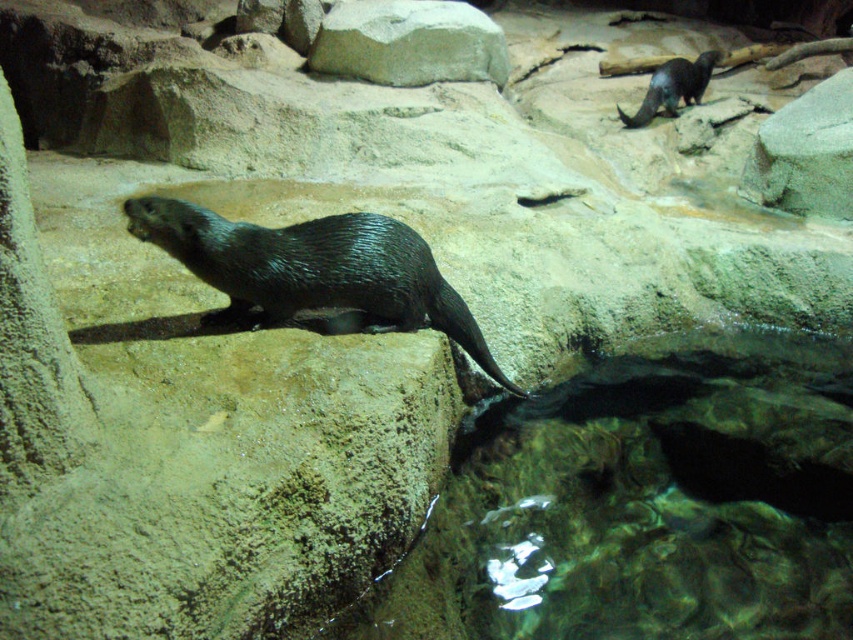
Does shiny black otter at center appear under shiny black beaver at upper right?

Yes.

Who is shorter, shiny black otter at center or shiny black beaver at upper right?

With less height is shiny black beaver at upper right.

Is point (325, 264) closer to camera compared to point (630, 124)?

Yes.

This screenshot has height=640, width=853. Find the location of `shiny black otter at center`. shiny black otter at center is located at coordinates (314, 268).

Can you confirm if shiny black otter at center is taller than gray stone boulder at upper center?

No, shiny black otter at center is not taller than gray stone boulder at upper center.

Can you confirm if shiny black otter at center is positioned to the right of gray stone boulder at upper center?

Incorrect, shiny black otter at center is not on the right side of gray stone boulder at upper center.

Is point (201, 237) positioned after point (320, 49)?

No, (201, 237) is in front of (320, 49).

You are a GUI agent. You are given a task and a screenshot of the screen. Output one action in this format:
    pyautogui.click(x=<x>, y=<y>)
    Task: Click on the shiny black otter at center
    
    Given the screenshot: What is the action you would take?
    pyautogui.click(x=314, y=268)

Is gray stone boulder at upper center shorter than shiny black beaver at upper right?

No.

Which of these two, gray stone boulder at upper center or shiny black beaver at upper right, stands shorter?

shiny black beaver at upper right is shorter.

Is point (354, 61) more distant than point (668, 112)?

No, (354, 61) is closer to viewer.

The image size is (853, 640). Find the location of `gray stone boulder at upper center`. gray stone boulder at upper center is located at coordinates click(409, 42).